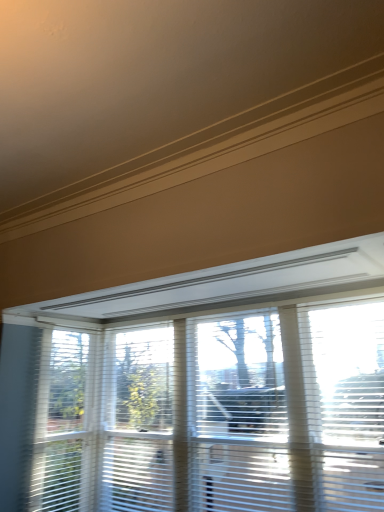
Describe the element at coordinates (202, 390) in the screenshot. I see `white blinds at center` at that location.

Image resolution: width=384 pixels, height=512 pixels. In order to click on white blinds at center in this screenshot , I will do `click(202, 390)`.

I want to click on white blinds at center, so click(202, 390).